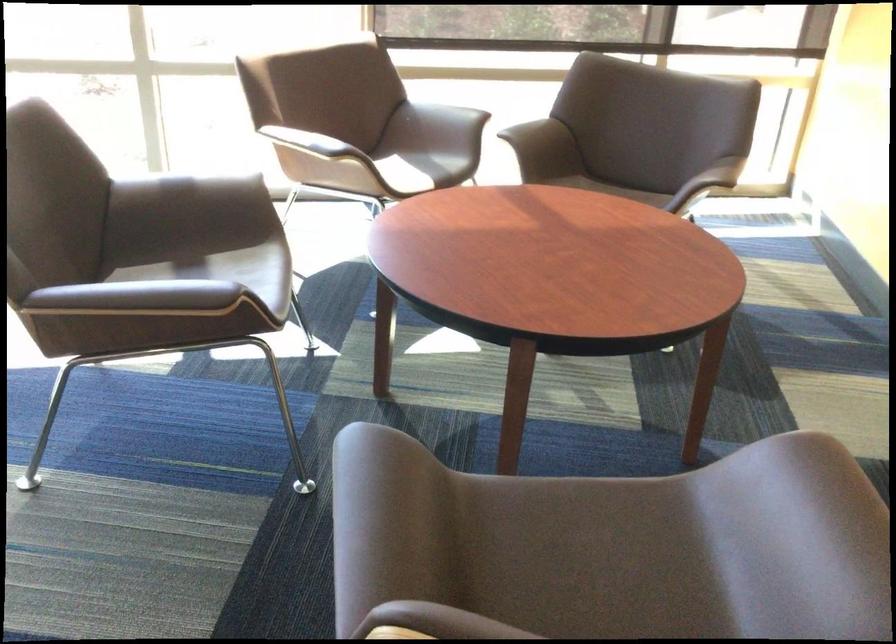
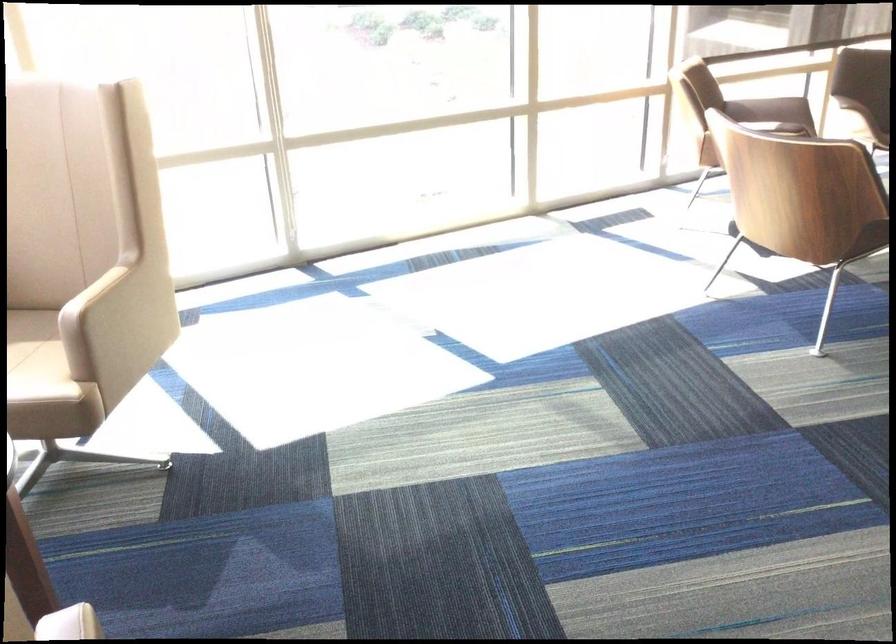
Question: The images are taken continuously from a first-person perspective. In which direction are you moving?

Choices:
 (A) Left
 (B) Right
 (C) Forward
 (D) Backward

Answer: (A)